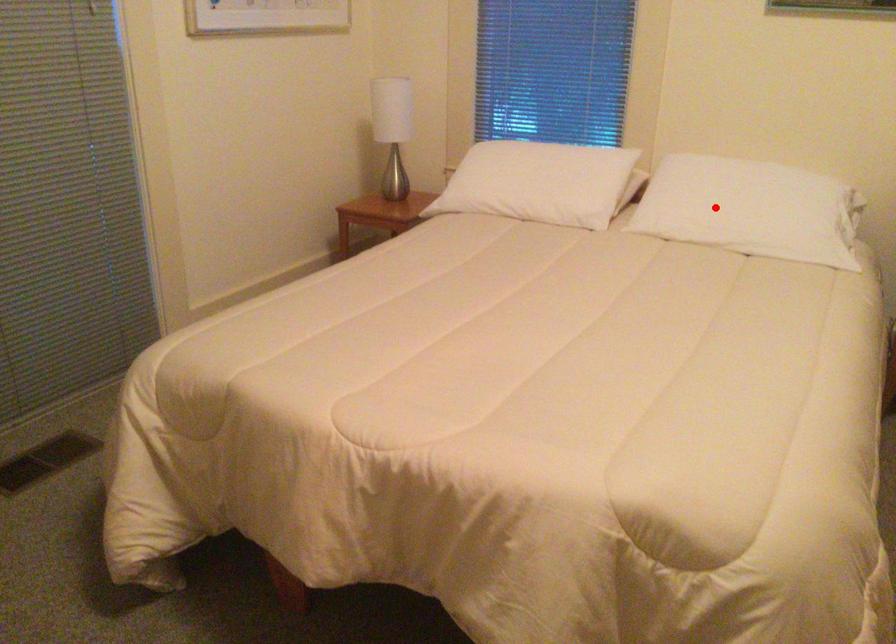
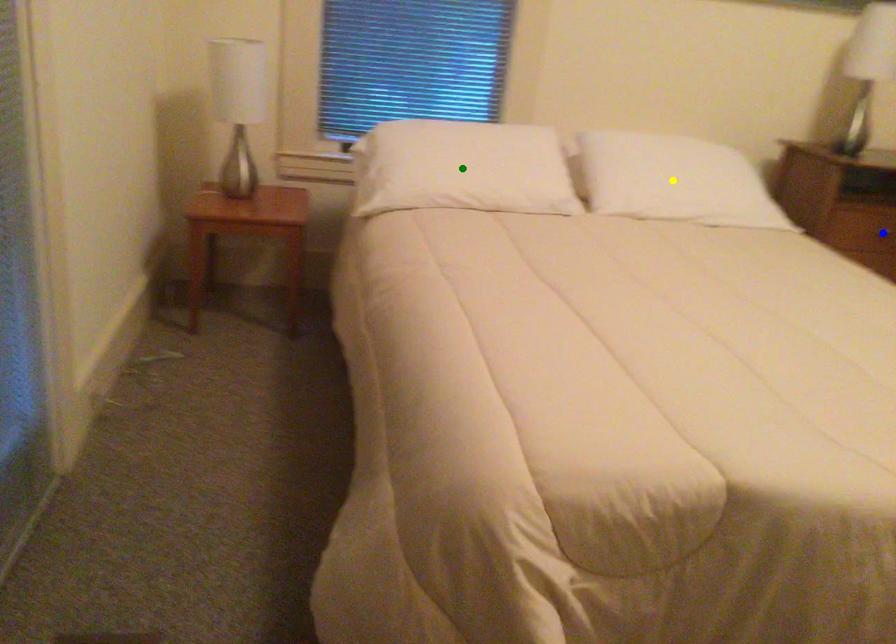
Question: I am providing you with two images of the same scene from different viewpoints. A red point is marked on the first image. You are given multiple points on the second image. Which point in image 2 represents the same 3d spot as the red point in image 1?

Choices:
 (A) yellow point
 (B) blue point
 (C) green point

Answer: (A)